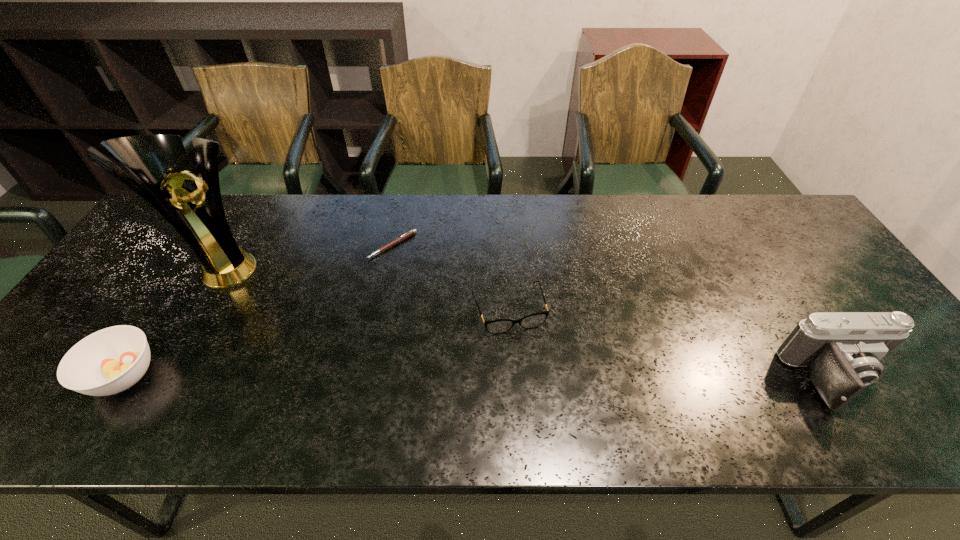
At what (x,y) coordinates should I click in order to perform the action: click on soup bowl present at the near edge. Please return your answer as a coordinate pair (x, y). The width and height of the screenshot is (960, 540). Looking at the image, I should click on (109, 361).

Find the location of a particular element. The image size is (960, 540). camera present at the near edge is located at coordinates (842, 351).

Identify the location of object that is at the left edge. (109, 361).

Find the location of a particular element. object at the right edge is located at coordinates (842, 351).

This screenshot has width=960, height=540. Identify the location of object at the near left corner. (109, 361).

This screenshot has width=960, height=540. I want to click on object situated at the near right corner, so click(842, 351).

You are a GUI agent. You are given a task and a screenshot of the screen. Output one action in this format:
    pyautogui.click(x=<x>, y=<y>)
    Task: Click on the vacant region at the far edge of the desktop
    
    Given the screenshot: What is the action you would take?
    click(x=436, y=234)

Where is `vacant space at the right edge of the desktop`? The height and width of the screenshot is (540, 960). vacant space at the right edge of the desktop is located at coordinates (826, 306).

The image size is (960, 540). I want to click on vacant space at the far left corner of the desktop, so click(x=163, y=232).

The width and height of the screenshot is (960, 540). In the image, there is a desktop. Find the location of `vacant space at the far right corner`. vacant space at the far right corner is located at coordinates (774, 239).